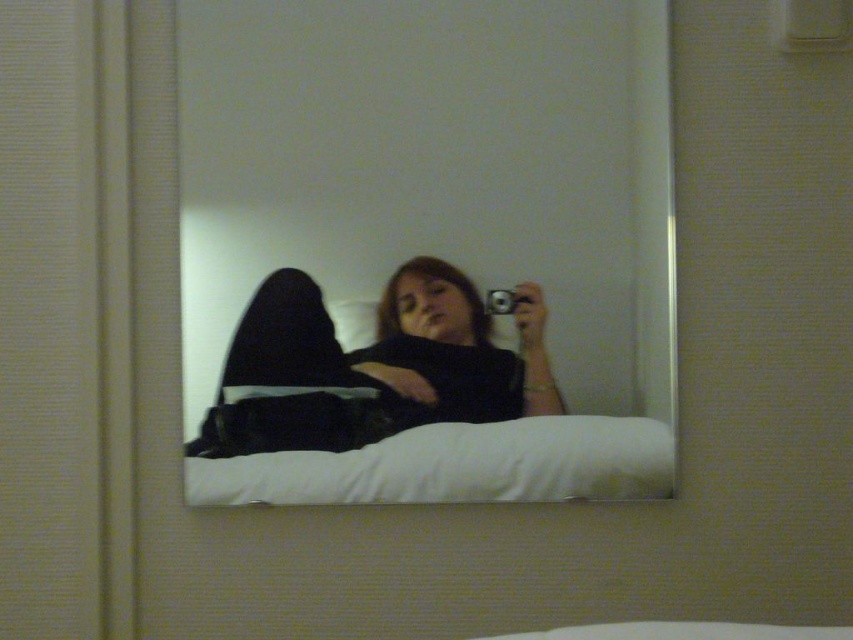
Can you confirm if black matte pants at center is bigger than white soft pillow at center?

Correct, black matte pants at center is larger in size than white soft pillow at center.

Measure the distance between point (263, 300) and camera.

They are 5.60 feet apart.

Between point (543, 413) and point (550, 470), which one is positioned in front?

Positioned in front is point (550, 470).

Locate an element on the screen. The width and height of the screenshot is (853, 640). black matte pants at center is located at coordinates (373, 365).

Between clear glass mirror at upper center and white soft pillow at center, which one appears on the left side from the viewer's perspective?

From the viewer's perspective, clear glass mirror at upper center appears more on the left side.

Between clear glass mirror at upper center and white soft pillow at center, which one is positioned lower?

white soft pillow at center

Does point (241, 113) come behind point (428, 442)?

No, (241, 113) is closer to viewer.

Locate an element on the screen. clear glass mirror at upper center is located at coordinates (439, 220).

Who is higher up, clear glass mirror at upper center or black matte pants at center?

clear glass mirror at upper center is above.

Does clear glass mirror at upper center have a greater width compared to black matte pants at center?

Yes.

At what (x,y) coordinates should I click in order to perform the action: click on clear glass mirror at upper center. Please return your answer as a coordinate pair (x, y). Looking at the image, I should click on (439, 220).